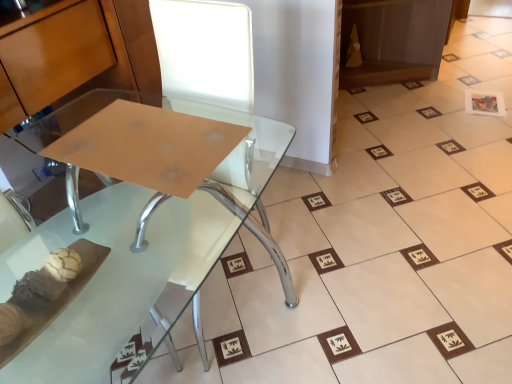
Locate an element on the screen. vacant space underneath white paper at upper right (from a real-world perspective) is located at coordinates (485, 103).